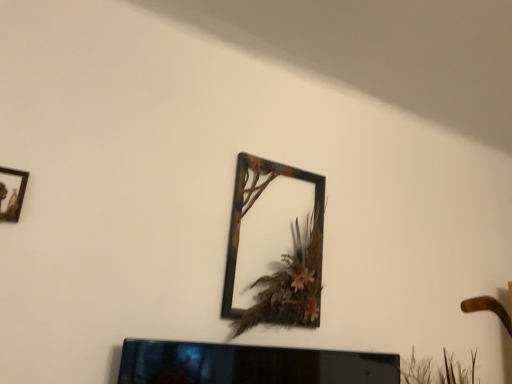
Question: Is black glossy tv at lower center to the left or to the right of metallic frame at upper center, the 1th picture frame in the back-to-front sequence, in the image?

Choices:
 (A) left
 (B) right

Answer: (A)

Question: Considering the positions of point (349, 369) and point (317, 180), is point (349, 369) closer or farther from the camera than point (317, 180)?

Choices:
 (A) farther
 (B) closer

Answer: (B)

Question: Estimate the real-world distances between objects in this image. Which object is closer to the metallic frame at upper center, which is the second picture frame in front-to-back order?

Choices:
 (A) wooden frame at upper left, arranged as the second picture frame when viewed from the back
 (B) black glossy tv at lower center

Answer: (B)

Question: Considering the real-world distances, which object is closest to the metallic frame at upper center, the 2th picture frame in the left-to-right sequence?

Choices:
 (A) black glossy tv at lower center
 (B) wooden frame at upper left, arranged as the second picture frame when viewed from the back

Answer: (A)